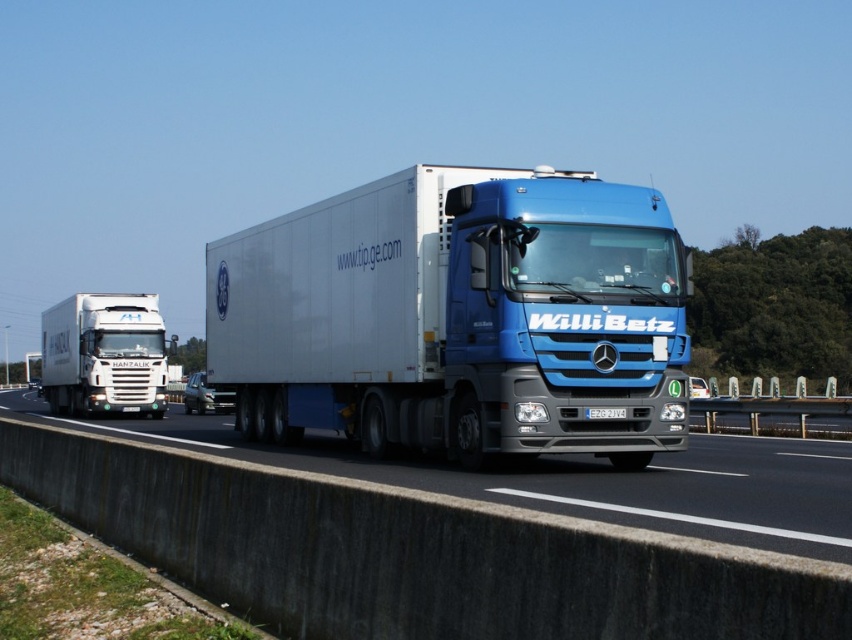
Question: Which point is farther to the camera?

Choices:
 (A) blue glossy trailer truck at center
 (B) blue metallic truck at center
 (C) white plastic license plate at center
 (D) white glossy truck at left

Answer: (D)

Question: Is blue glossy trailer truck at center further to camera compared to white glossy truck at left?

Choices:
 (A) no
 (B) yes

Answer: (A)

Question: Among these objects, which one is farthest from the camera?

Choices:
 (A) white plastic license plate at center
 (B) white glossy truck at left
 (C) blue metallic truck at center

Answer: (B)

Question: Can you confirm if blue glossy trailer truck at center is positioned to the left of blue metallic truck at center?

Choices:
 (A) yes
 (B) no

Answer: (B)

Question: Which point is farther to the camera?

Choices:
 (A) blue metallic truck at center
 (B) blue glossy trailer truck at center

Answer: (B)

Question: Is blue glossy trailer truck at center further to the viewer compared to white glossy truck at left?

Choices:
 (A) yes
 (B) no

Answer: (B)